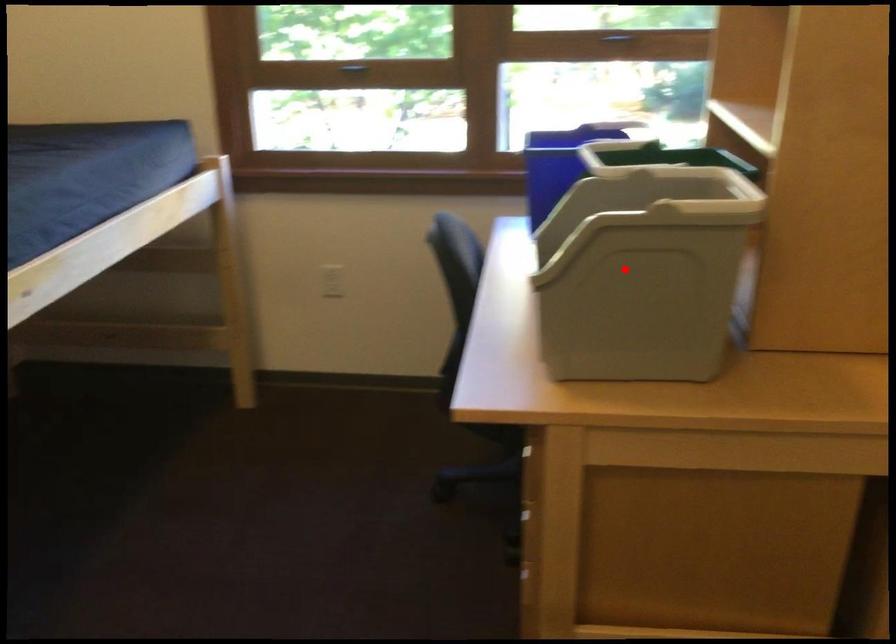
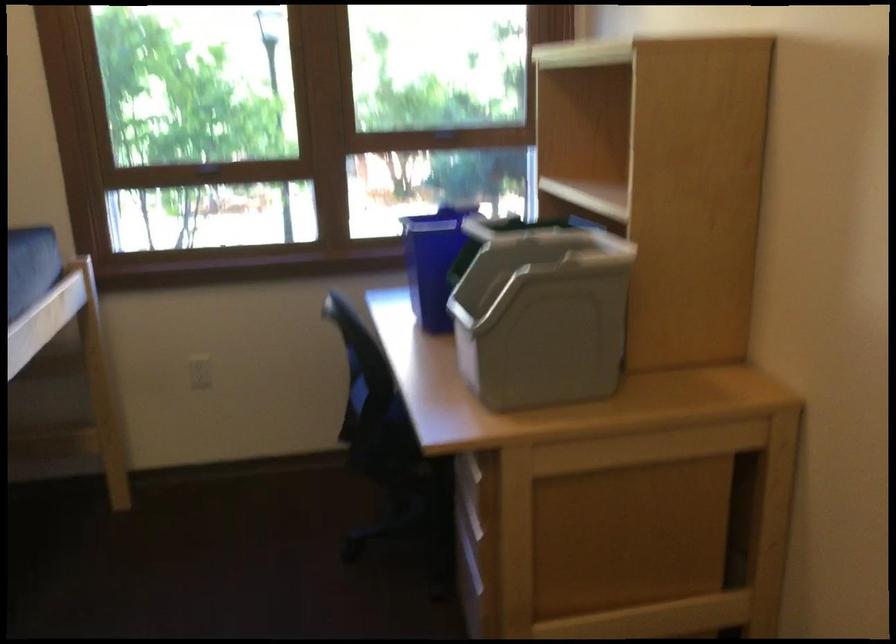
Question: I am providing you with two images of the same scene from different viewpoints. A red point is marked on the first image. Can you still see the location of the red point in image 2?

Choices:
 (A) Yes
 (B) No

Answer: (A)